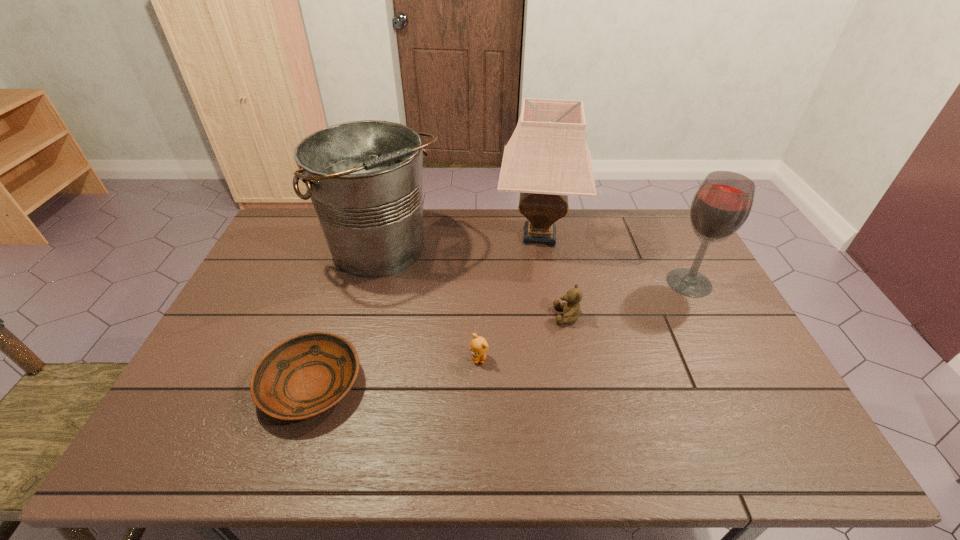
Identify the location of unoccupied area between the bucket and the shortest object. This screenshot has width=960, height=540. (348, 318).

Find the location of a particular element. This screenshot has width=960, height=540. free spot between the rightmost object and the third shortest object is located at coordinates (628, 299).

The image size is (960, 540). In order to click on free area in between the plate and the bucket in this screenshot , I will do `click(348, 318)`.

You are a GUI agent. You are given a task and a screenshot of the screen. Output one action in this format:
    pyautogui.click(x=<x>, y=<y>)
    Task: Click on the free space between the lampshade and the shortest object
    The height and width of the screenshot is (540, 960).
    Given the screenshot: What is the action you would take?
    pyautogui.click(x=425, y=310)

Select which object is the closest to the lampshade. Please provide its 2D coordinates. Your answer should be formatted as a tuple, i.e. [(x, y)], where the tuple contains the x and y coordinates of a point satisfying the conditions above.

[(364, 178)]

The height and width of the screenshot is (540, 960). What are the coordinates of `object that is the third closest to the right teddy bear` in the screenshot? It's located at (721, 205).

Locate an element on the screen. free spot that satisfies the following two spatial constraints: 1. on the back side of the shortest object; 2. on the left side of the lampshade is located at coordinates (361, 236).

Image resolution: width=960 pixels, height=540 pixels. In order to click on vacant space that satisfies the following two spatial constraints: 1. on the front-facing side of the taller teddy bear; 2. on the face of the left teddy bear in this screenshot , I will do `click(576, 358)`.